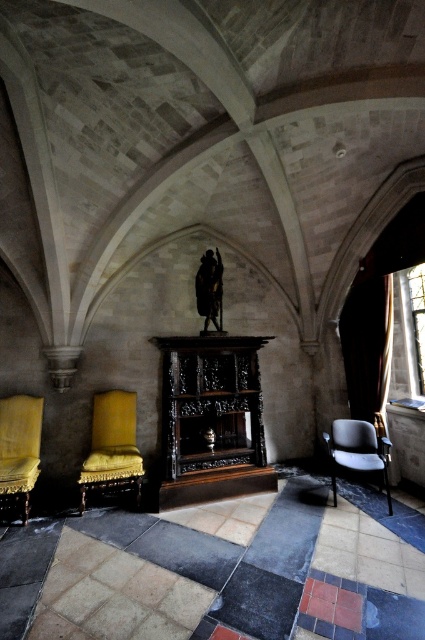
You are a guest in this historical room and want to sit in one of the armchairs. The velvet yellow armchair at left and the matte black armchair at lower right are available. If you prefer a wider seat, which armchair should you choose?

The matte black armchair at lower right is wider than the velvet yellow armchair at left, so you should choose the matte black armchair at lower right.